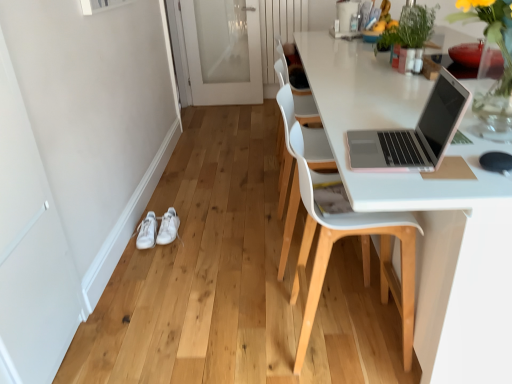
Question: Can you confirm if white leather sneakers at lower left, the second footwear when ordered from left to right, is positioned to the left of green leafy plant at upper right?

Choices:
 (A) no
 (B) yes

Answer: (B)

Question: Are white leather sneakers at lower left, the second footwear when ordered from left to right, and green leafy plant at upper right beside each other?

Choices:
 (A) yes
 (B) no

Answer: (B)

Question: Considering the relative sizes of white leather sneakers at lower left, the second footwear when ordered from left to right, and green leafy plant at upper right in the image provided, is white leather sneakers at lower left, the second footwear when ordered from left to right, smaller than green leafy plant at upper right?

Choices:
 (A) yes
 (B) no

Answer: (A)

Question: Is white leather sneakers at lower left, the second footwear when ordered from left to right, surrounding green leafy plant at upper right?

Choices:
 (A) yes
 (B) no

Answer: (B)

Question: Considering the positions of white leather sneakers at lower left, the second footwear when ordered from left to right, and white leather sneakers at lower left, the second footwear in the right-to-left sequence, in the image, is white leather sneakers at lower left, the second footwear when ordered from left to right, taller or shorter than white leather sneakers at lower left, the second footwear in the right-to-left sequence,?

Choices:
 (A) short
 (B) tall

Answer: (A)

Question: Considering the positions of white leather sneakers at lower left, positioned as the 1th footwear in right-to-left order, and white leather sneakers at lower left, the second footwear in the right-to-left sequence, in the image, is white leather sneakers at lower left, positioned as the 1th footwear in right-to-left order, wider or thinner than white leather sneakers at lower left, the second footwear in the right-to-left sequence,?

Choices:
 (A) wide
 (B) thin

Answer: (A)

Question: Visually, is white leather sneakers at lower left, positioned as the 1th footwear in right-to-left order, positioned to the left or to the right of white leather sneakers at lower left, the 1th footwear from the left?

Choices:
 (A) right
 (B) left

Answer: (A)

Question: Is point (166, 223) closer or farther from the camera than point (138, 238)?

Choices:
 (A) closer
 (B) farther

Answer: (B)

Question: From a real-world perspective, relative to white glossy screen door at lower left, the second screen door viewed from the right, is white plastic chair at center, the 1th chair viewed from the back, vertically above or below?

Choices:
 (A) above
 (B) below

Answer: (B)

Question: Is white plastic chair at center, arranged as the second chair when viewed from the front, inside the boundaries of white glossy screen door at lower left, placed as the first screen door when sorted from bottom to top, or outside?

Choices:
 (A) inside
 (B) outside

Answer: (B)

Question: Considering the relative positions of white plastic chair at center, arranged as the second chair when viewed from the front, and white glossy screen door at lower left, the second screen door viewed from the right, in the image provided, is white plastic chair at center, arranged as the second chair when viewed from the front, to the left or to the right of white glossy screen door at lower left, the second screen door viewed from the right,?

Choices:
 (A) right
 (B) left

Answer: (A)

Question: Considering the positions of point (285, 178) and point (12, 102), is point (285, 178) closer or farther from the camera than point (12, 102)?

Choices:
 (A) farther
 (B) closer

Answer: (A)

Question: Considering the relative positions of green leafy plant at upper right and white plastic chair at right, which is the 1th chair in front-to-back order, in the image provided, is green leafy plant at upper right to the left or to the right of white plastic chair at right, which is the 1th chair in front-to-back order,?

Choices:
 (A) right
 (B) left

Answer: (A)

Question: In the image, is green leafy plant at upper right positioned in front of or behind white plastic chair at right, which is the 2th chair from back to front?

Choices:
 (A) front
 (B) behind

Answer: (B)